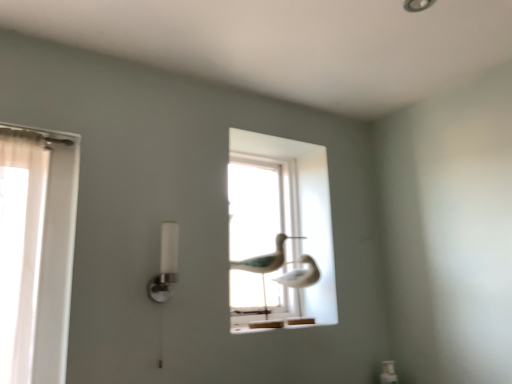
Question: Is white frosted glass lamp at center left not inside transparent glass birds at center?

Choices:
 (A) yes
 (B) no

Answer: (A)

Question: Can you confirm if white frosted glass lamp at center left is wider than transparent glass birds at center?

Choices:
 (A) yes
 (B) no

Answer: (B)

Question: Does white frosted glass lamp at center left have a smaller size compared to transparent glass birds at center?

Choices:
 (A) no
 (B) yes

Answer: (B)

Question: Can you confirm if white frosted glass lamp at center left is bigger than transparent glass birds at center?

Choices:
 (A) no
 (B) yes

Answer: (A)

Question: From the image's perspective, is white frosted glass lamp at center left on transparent glass birds at center?

Choices:
 (A) no
 (B) yes

Answer: (A)

Question: Is white frosted glass lamp at center left bigger or smaller than white matte bird at center?

Choices:
 (A) big
 (B) small

Answer: (B)

Question: Relative to white matte bird at center, is white frosted glass lamp at center left in front or behind?

Choices:
 (A) behind
 (B) front

Answer: (B)

Question: From the image's perspective, is white frosted glass lamp at center left positioned above or below white matte bird at center?

Choices:
 (A) below
 (B) above

Answer: (B)

Question: Would you say white frosted glass lamp at center left is inside or outside white matte bird at center?

Choices:
 (A) inside
 (B) outside

Answer: (B)

Question: From the image's perspective, is white matte bird at center above or below white frosted glass lamp at center left?

Choices:
 (A) above
 (B) below

Answer: (B)

Question: In terms of height, does white matte bird at center look taller or shorter compared to white frosted glass lamp at center left?

Choices:
 (A) tall
 (B) short

Answer: (A)

Question: In the image, is white matte bird at center on the left side or the right side of white frosted glass lamp at center left?

Choices:
 (A) right
 (B) left

Answer: (A)

Question: Considering their positions, is white matte bird at center located in front of or behind white frosted glass lamp at center left?

Choices:
 (A) behind
 (B) front

Answer: (A)

Question: Is transparent glass birds at center spatially inside white frosted glass lamp at center left, or outside of it?

Choices:
 (A) outside
 (B) inside

Answer: (A)

Question: From the image's perspective, is transparent glass birds at center positioned above or below white frosted glass lamp at center left?

Choices:
 (A) below
 (B) above

Answer: (B)